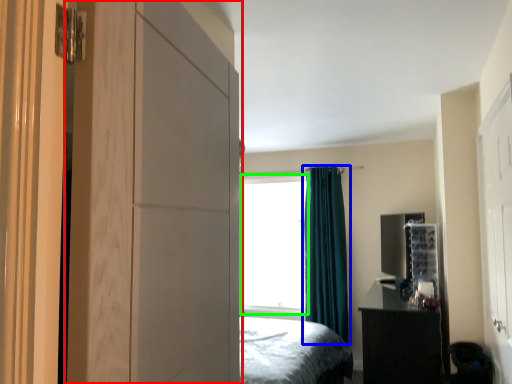
Question: Based on their relative distances, which object is farther from dresser (highlighted by a red box)? Choose from curtain (highlighted by a blue box) and window screen (highlighted by a green box).

Choices:
 (A) curtain
 (B) window screen

Answer: (B)